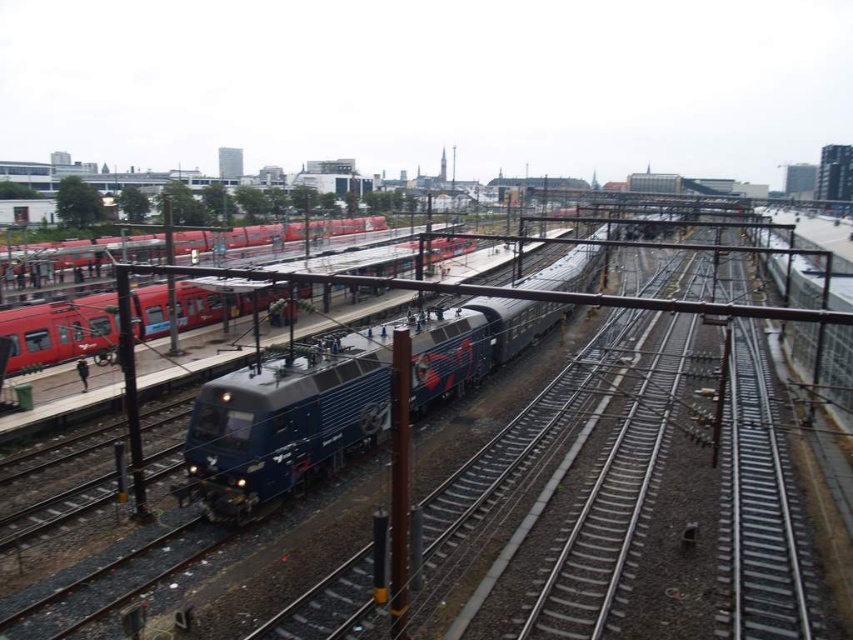
Is metallic blue locomotive at center taller than matte red train at left?

Correct, metallic blue locomotive at center is much taller as matte red train at left.

What do you see at coordinates (337, 400) in the screenshot? The width and height of the screenshot is (853, 640). I see `metallic blue locomotive at center` at bounding box center [337, 400].

Find the location of a particular element. The image size is (853, 640). metallic blue locomotive at center is located at coordinates (337, 400).

Who is shorter, metallic blue train at center or red matte train at left?

metallic blue train at center

Can you confirm if metallic blue train at center is wider than red matte train at left?

Correct, the width of metallic blue train at center exceeds that of red matte train at left.

Identify the location of metallic blue train at center. (622, 497).

Locate an element on the screen. Image resolution: width=853 pixels, height=640 pixels. metallic blue train at center is located at coordinates (622, 497).

Between point (9, 337) and point (279, 221), which one is positioned behind?

Positioned behind is point (279, 221).

Is matte red train at left further to camera compared to red matte train at left?

No.

Locate an element on the screen. The width and height of the screenshot is (853, 640). matte red train at left is located at coordinates (59, 330).

Locate an element on the screen. matte red train at left is located at coordinates (59, 330).